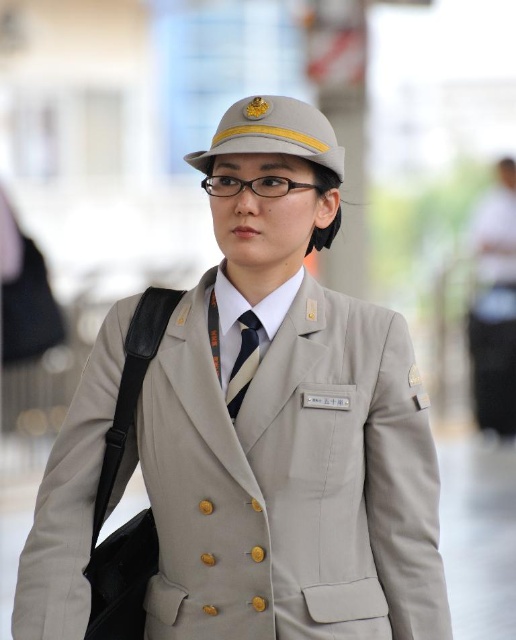
Question: Can you confirm if beige uniform at center is bigger than dark blue silk tie at center?

Choices:
 (A) yes
 (B) no

Answer: (A)

Question: Which point appears farthest from the camera in this image?

Choices:
 (A) (241, 324)
 (B) (267, 237)

Answer: (A)

Question: Which point is closer to the camera?

Choices:
 (A) dark blue silk tie at center
 (B) beige uniform at center

Answer: (B)

Question: Does beige uniform at center lie behind dark blue silk tie at center?

Choices:
 (A) yes
 (B) no

Answer: (B)

Question: Which point is farther to the camera?

Choices:
 (A) (268, 536)
 (B) (254, 360)

Answer: (B)

Question: Does beige uniform at center have a lesser width compared to dark blue silk tie at center?

Choices:
 (A) no
 (B) yes

Answer: (A)